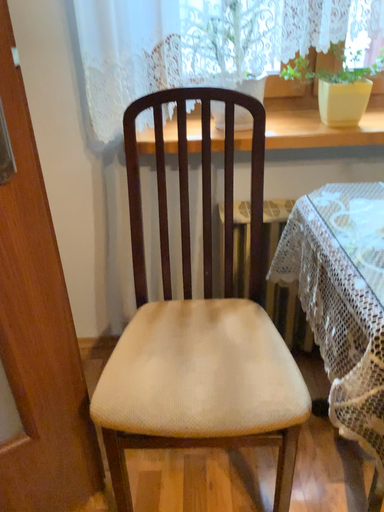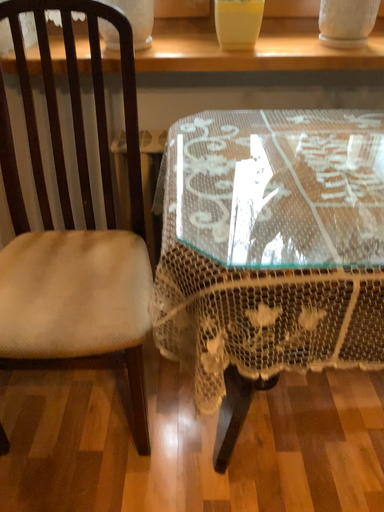
Question: How did the camera likely rotate when shooting the video?

Choices:
 (A) rotated downward
 (B) rotated upward

Answer: (A)